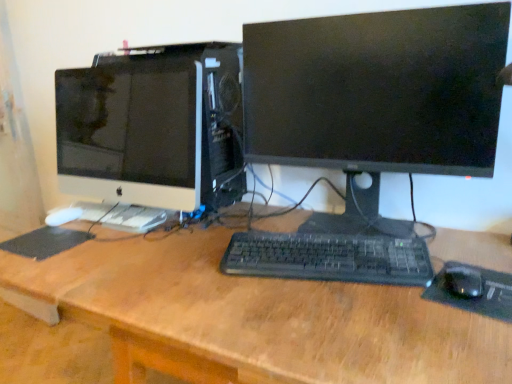
Find the location of a particular element. free space above white matte keyboard at left (from a real-world perspective) is located at coordinates (112, 207).